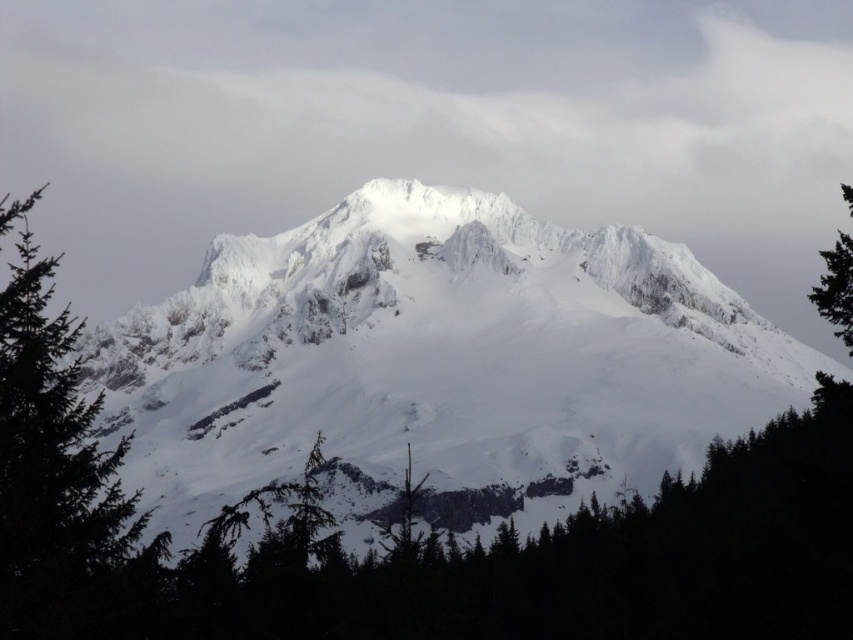
Question: Which point is farther from the camera taking this photo?

Choices:
 (A) (1, 579)
 (B) (395, 342)
 (C) (439, 51)

Answer: (C)

Question: Does white snow-covered mountain at center appear on the left side of green matte tree at left?

Choices:
 (A) yes
 (B) no

Answer: (B)

Question: Which point is farther to the camera?

Choices:
 (A) white snow-covered mountain at center
 (B) white fluffy cloud at center
 (C) green matte tree at left

Answer: (B)

Question: Does green matte tree at left appear on the left side of green matte tree at right?

Choices:
 (A) no
 (B) yes

Answer: (B)

Question: Does white fluffy cloud at center appear under white snow-covered mountain at center?

Choices:
 (A) no
 (B) yes

Answer: (A)

Question: Which of the following is the farthest from the observer?

Choices:
 (A) (813, 291)
 (B) (44, 547)
 (C) (851, 67)
 (D) (355, 317)

Answer: (C)